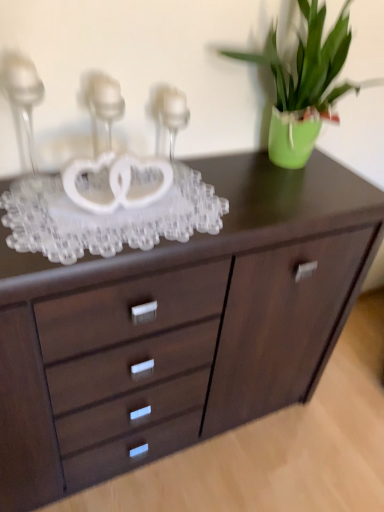
At what (x,y) coordinates should I click in order to perform the action: click on free space in front of clear glass candle holder at center, placed as the 3th candle holder when sorted from left to right. Please return your answer as a coordinate pair (x, y). Looking at the image, I should click on (176, 202).